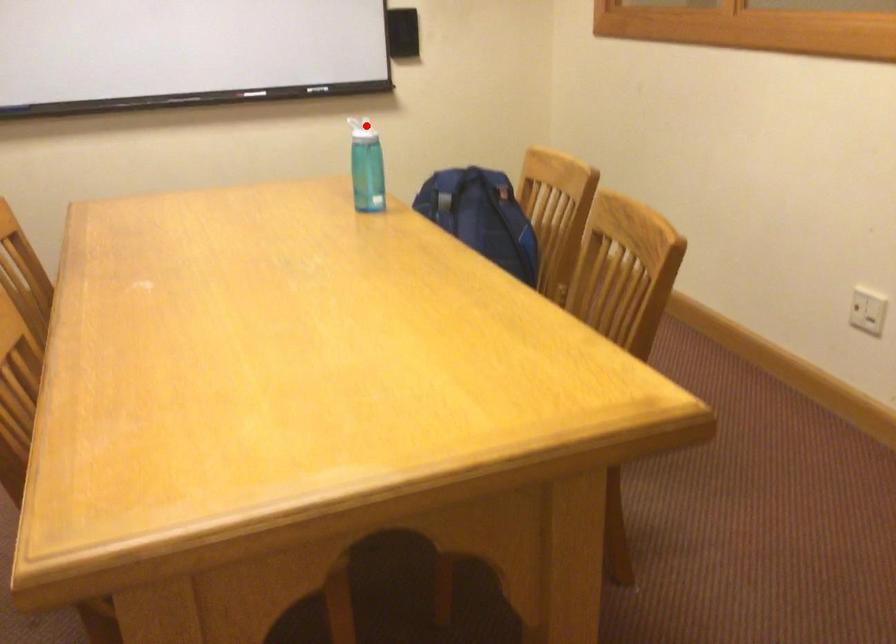
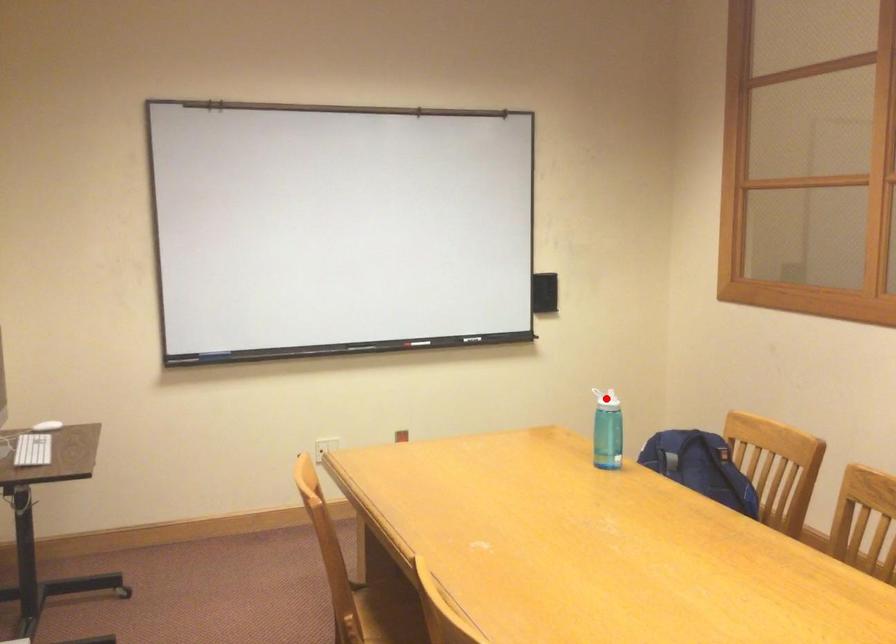
I am providing you with two images of the same scene from different viewpoints. A red point is marked on the first image and another point is marked on the second image. Does the point marked in image1 correspond to the same location as the one in image2?

Yes